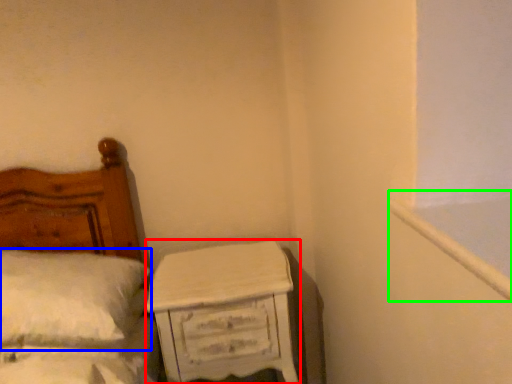
Question: Which is nearer to the nightstand (highlighted by a red box)? pillow (highlighted by a blue box) or window frame (highlighted by a green box).

Choices:
 (A) pillow
 (B) window frame

Answer: (A)